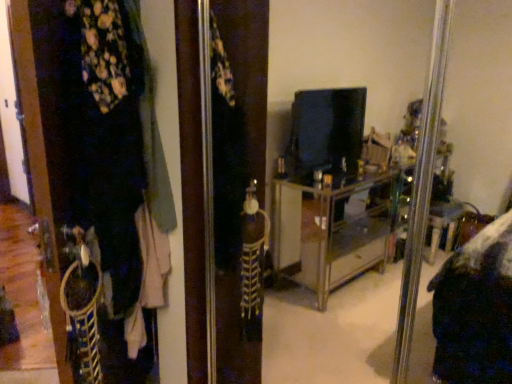
The width and height of the screenshot is (512, 384). What do you see at coordinates (100, 167) in the screenshot?
I see `velvet floral dress at left` at bounding box center [100, 167].

What is the approximate width of velvet floral dress at left?

velvet floral dress at left is 6.76 inches wide.

Where is `velvet floral dress at left`? The height and width of the screenshot is (384, 512). velvet floral dress at left is located at coordinates (100, 167).

Locate an element on the screen. This screenshot has height=384, width=512. velvet floral dress at left is located at coordinates (100, 167).